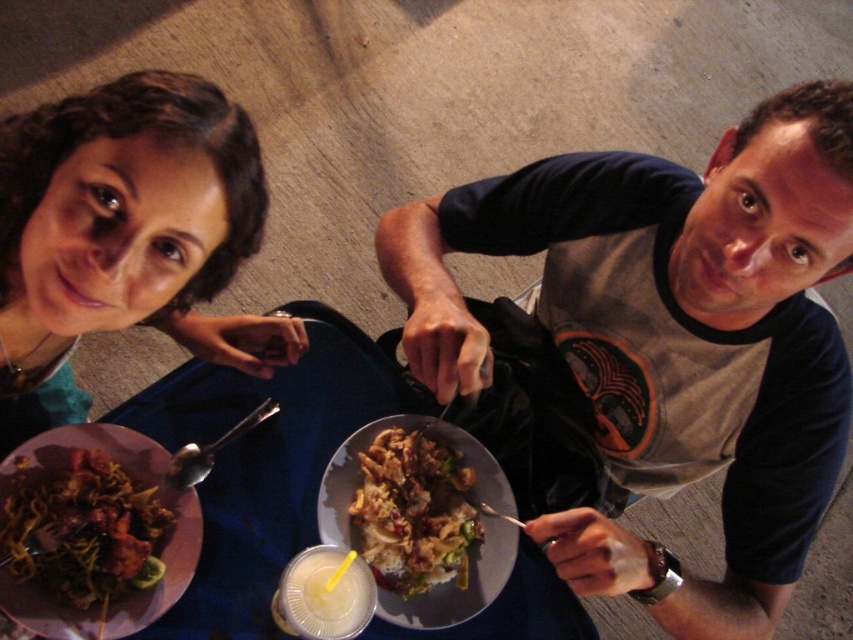
You are a server in a restaurant and need to place a 12 inch long dessert between the two people seated at the table. The two people are the shiny metallic plate at lower left and the other person. Can you fit the dessert between them without moving either of their plates?

The two people are 31.22 inches apart, and the dessert is only 12 inches long, so yes, the dessert can easily fit between the shiny metallic plate at lower left and the other person.

You are a photographer taking a picture of the scene from above. Which object, the matte teal shirt at upper left or the shiny brown meat at center, will appear larger in your photo?

The matte teal shirt at upper left will appear larger in the photo because it has a greater height compared to the shiny brown meat at center.